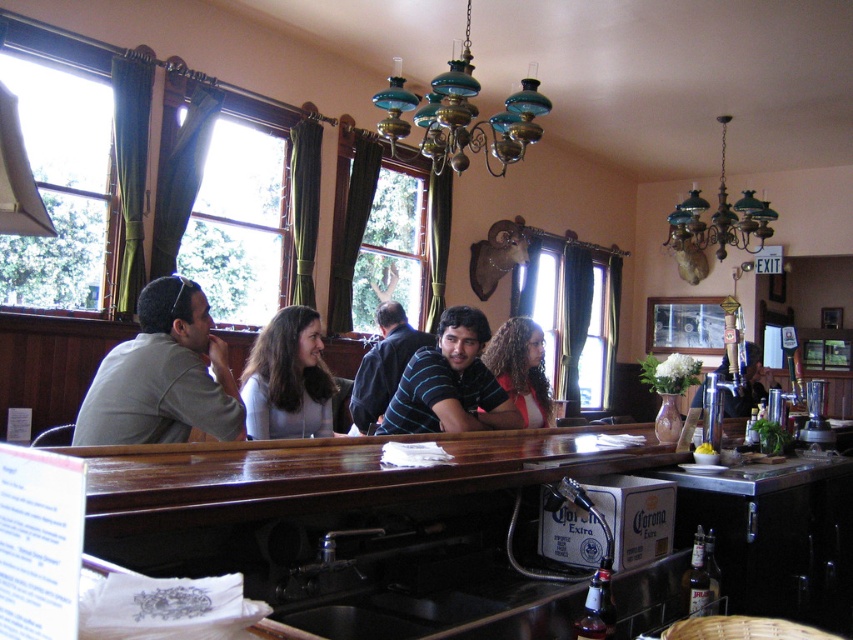
Can you confirm if wooden bar counter at center is smaller than translucent glass bottle at bar front?

Incorrect, wooden bar counter at center is not smaller in size than translucent glass bottle at bar front.

Can you confirm if wooden bar counter at center is positioned to the left of translucent glass bottle at bar front?

In fact, wooden bar counter at center is to the right of translucent glass bottle at bar front.

Does point (370, 592) lie in front of point (575, 621)?

No, (370, 592) is behind (575, 621).

Find the location of a particular element. wooden bar counter at center is located at coordinates (456, 532).

Based on the photo, who is lower down, teal glass chandelier at upper center or striped shirt at center?

striped shirt at center

Measure the distance between teal glass chandelier at upper center and striped shirt at center.

Result: teal glass chandelier at upper center and striped shirt at center are 3.94 feet apart.

Between point (451, 124) and point (386, 340), which one is positioned behind?

Positioned behind is point (386, 340).

Find the location of `teal glass chandelier at upper center`. teal glass chandelier at upper center is located at coordinates (460, 115).

Is wooden bar counter at center above striped shirt at center?

No, wooden bar counter at center is not above striped shirt at center.

Is wooden bar counter at center thinner than striped shirt at center?

In fact, wooden bar counter at center might be wider than striped shirt at center.

Is point (469, 596) farther from viewer compared to point (381, 305)?

No, (469, 596) is closer to viewer.

I want to click on wooden bar counter at center, so click(x=456, y=532).